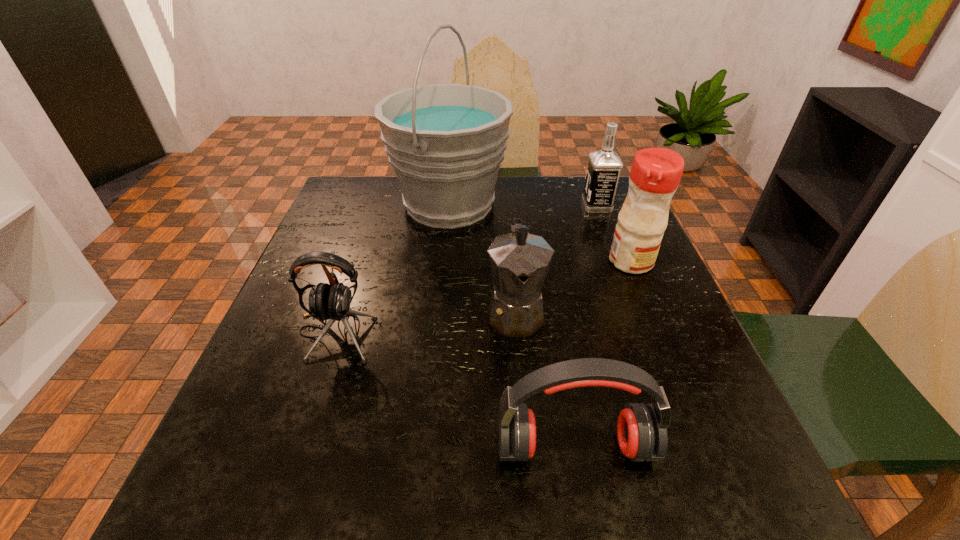
Locate an element on the screen. the tallest object is located at coordinates (445, 142).

I want to click on the fourth nearest object, so click(655, 174).

I want to click on the fifth shortest object, so click(x=655, y=174).

This screenshot has height=540, width=960. Identify the location of vodka. (604, 166).

Locate an element on the screen. Image resolution: width=960 pixels, height=540 pixels. coffeepot is located at coordinates (519, 261).

This screenshot has height=540, width=960. I want to click on the left earphone, so click(331, 302).

The image size is (960, 540). Identify the location of the nearest object. (641, 428).

Where is `the nearer earphone`? the nearer earphone is located at coordinates (641, 428).

You are a GUI agent. You are given a task and a screenshot of the screen. Output one action in this format:
    pyautogui.click(x=<x>, y=<y>)
    Task: Click on the free space located on the front of the tallest object
    
    Given the screenshot: What is the action you would take?
    pyautogui.click(x=434, y=348)

Where is `vacant space located 0.120m on the back of the second tallest object`? This screenshot has width=960, height=540. vacant space located 0.120m on the back of the second tallest object is located at coordinates (613, 220).